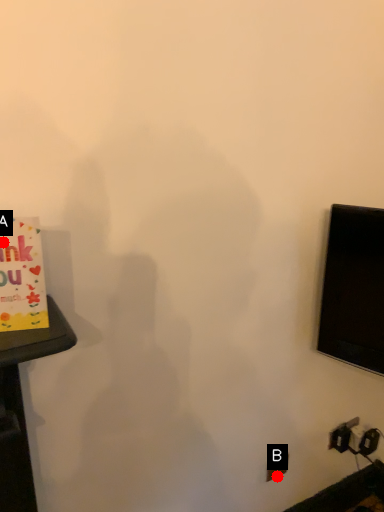
Question: Two points are circled on the image, labeled by A and B beside each circle. Which of the following is the farthest from the observer?

Choices:
 (A) A is further
 (B) B is further

Answer: (B)